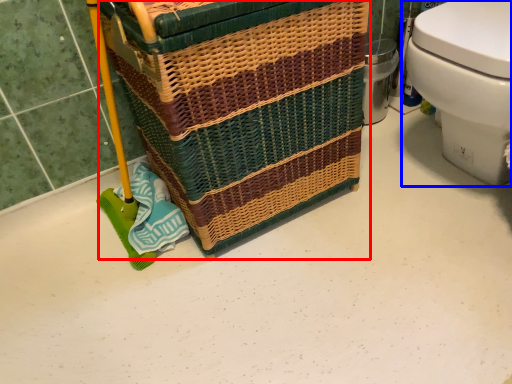
Question: Among these objects, which one is farthest to the camera, basket container (highlighted by a red box) or toilet (highlighted by a blue box)?

Choices:
 (A) basket container
 (B) toilet

Answer: (B)